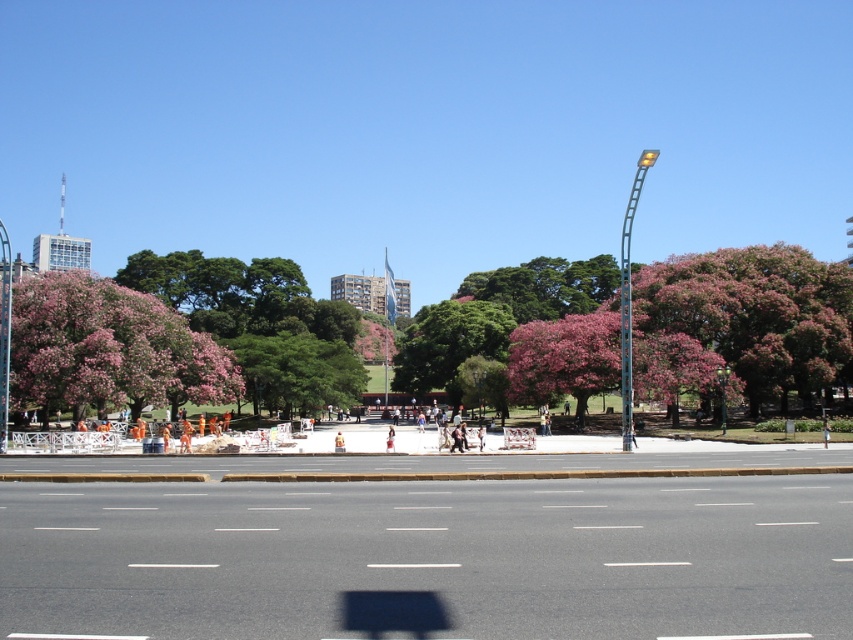
You are a landscape architect designing a new park layout. You have two trees to place in the park area shown in the image. The pink bloom tree at left and the pink textured tree at center. Based on their sizes, which tree should be placed closer to the construction site to ensure visibility of the construction workers from the park area?

The pink bloom tree at left is taller than the pink textured tree at center. To ensure visibility of the construction workers from the park area, the shorter pink textured tree at center should be placed closer to the construction site so that the taller tree does not block the view.

You are a pedestrian standing at the point with coordinates point (219, 349) and want to walk to the point with coordinates point (331, 388). Given the scene described, what potential obstacles might you encounter along the way?

The path from point (219, 349) to point (331, 388) passes through a construction site with workers and barriers, so you might encounter obstacles like construction barriers, materials, or active work zones.

You are a city planner evaluating the park layout. Considering the pink matte tree at upper right and the green leafy tree at center, which tree would provide more shade coverage for park visitors based on their height?

The pink matte tree at upper right is taller than the green leafy tree at center, so it would provide more shade coverage for park visitors.